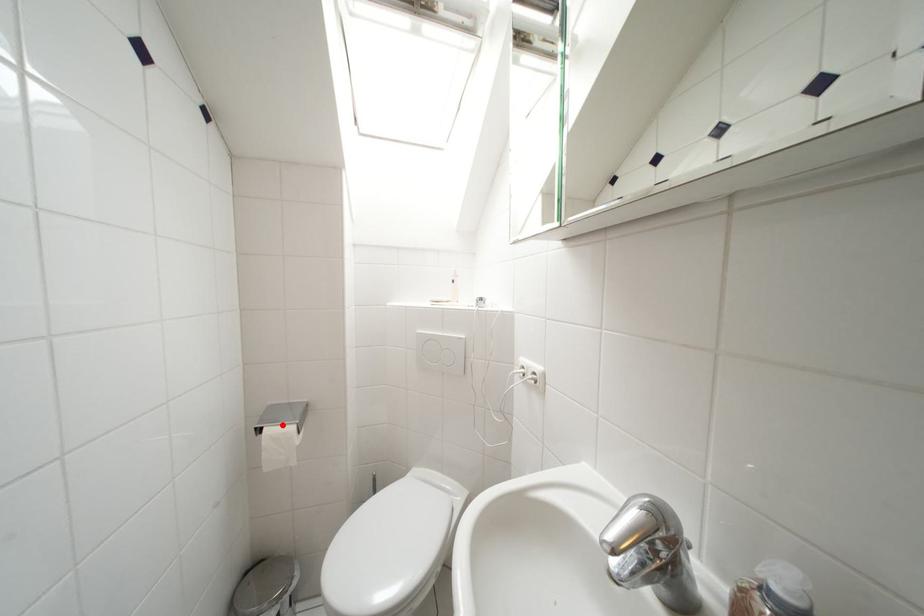
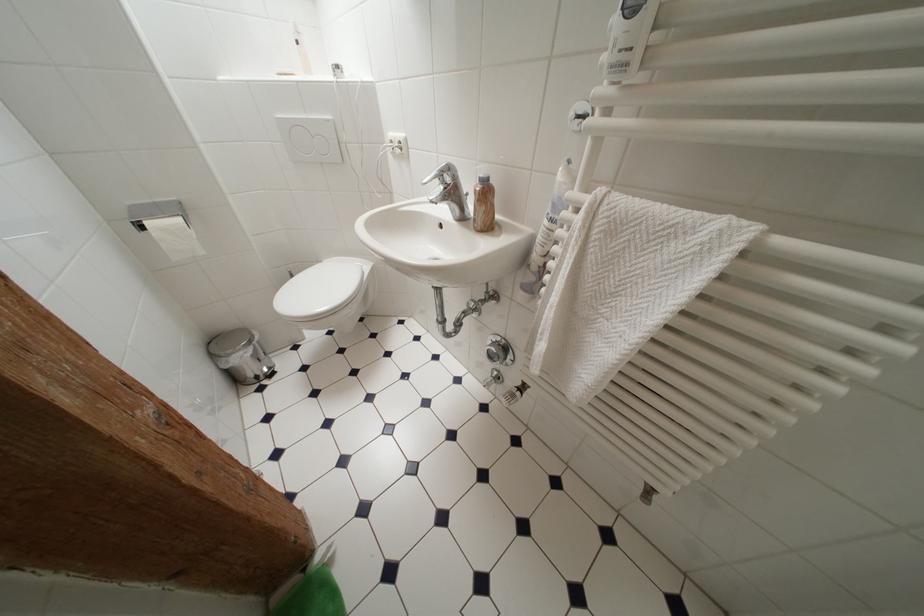
In the second image, find the point that corresponds to the highlighted location in the first image.

(160, 219)